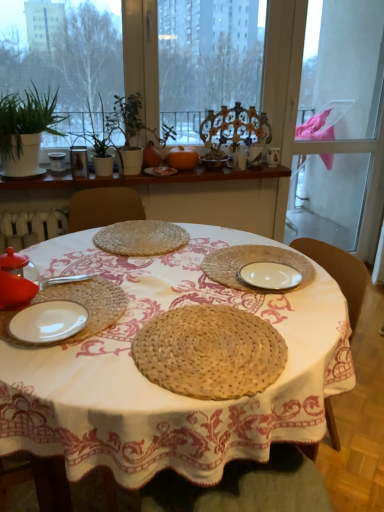
Find the location of a particular element. free point to the right of white glossy plate at lower left, which appears as the 1th plate when ordered from the bottom is located at coordinates (126, 326).